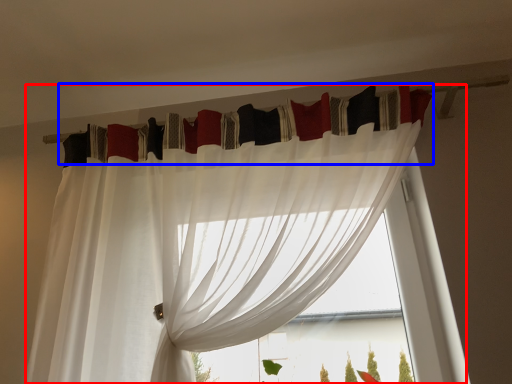
Question: Which point is closer to the camera, curtain (highlighted by a red box) or curtain (highlighted by a blue box)?

Choices:
 (A) curtain
 (B) curtain

Answer: (A)